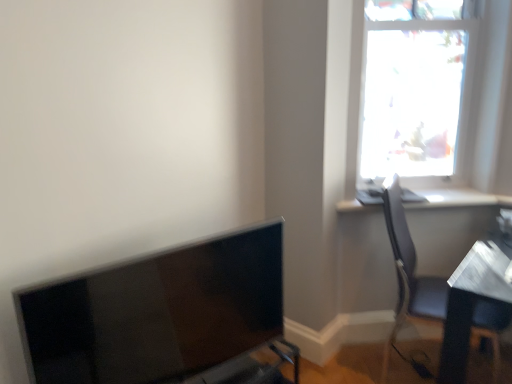
Identify the location of vacant space in transparent glass window at upper right (from a real-world perspective). The height and width of the screenshot is (384, 512). (429, 188).